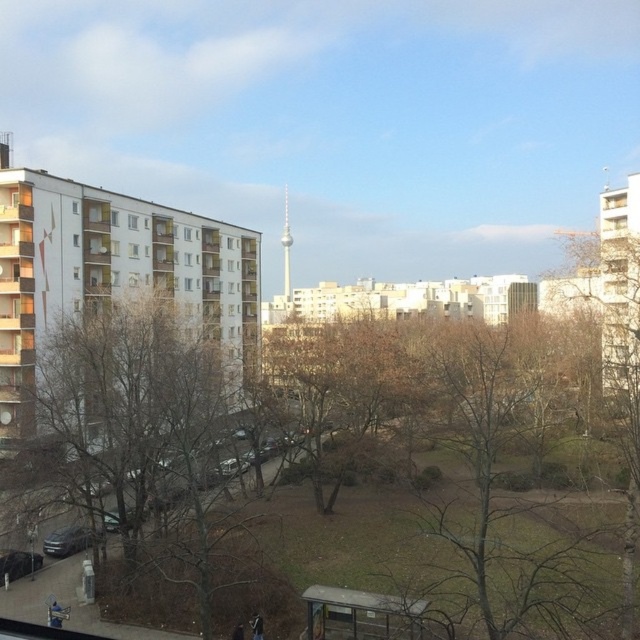
You are a window installer who needs to replace both the white glass window at upper left and the transparent glass window at upper left. Given that your ladder can extend up to 8 meters, can you safely reach both windows using the same ladder without moving it?

The distance between the white glass window at upper left and transparent glass window at upper left is 7.90 meters. Since the ladder can extend up to 8 meters, it is possible to safely reach both windows without moving the ladder as the required distance is within the ladder capacity.

You are standing at the bus stop shelter at bottom center right and want to look at the point marked at coordinates point (525,472). What object will you see in that direction?

The point (525,472) is on a brown leafless tree at center, so you will see the brown leafless tree at center in that direction.

You are a city planner assessing the urban layout. You notice the brown leafless tree at left and the white glass window at upper left. Which object occupies a greater vertical space in the scene?

The brown leafless tree at left is much taller than the white glass window at upper left, so it occupies more vertical space in the scene.